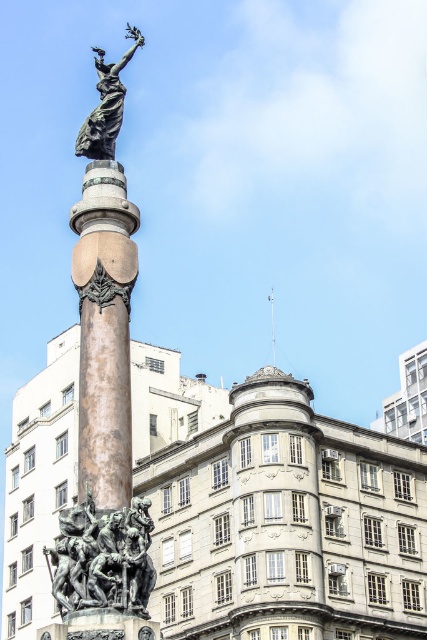
Question: Is bronze column at center smaller than bronze/brass statue at lower left?

Choices:
 (A) yes
 (B) no

Answer: (A)

Question: Does bronze column at center appear over bronze/brass statue at lower left?

Choices:
 (A) yes
 (B) no

Answer: (A)

Question: Is bronze column at center positioned at the back of bronze/brass statue at lower left?

Choices:
 (A) no
 (B) yes

Answer: (B)

Question: Which point is farther to the camera?

Choices:
 (A) (96, 108)
 (B) (140, 540)
 (C) (105, 252)

Answer: (A)

Question: Among these points, which one is farthest from the camera?

Choices:
 (A) (120, 67)
 (B) (84, 148)

Answer: (A)

Question: Which object is positioned closest to the bronze/brass statue at lower left?

Choices:
 (A) bronze column at center
 (B) bronze statue at center
 (C) bronze statue at upper center

Answer: (A)